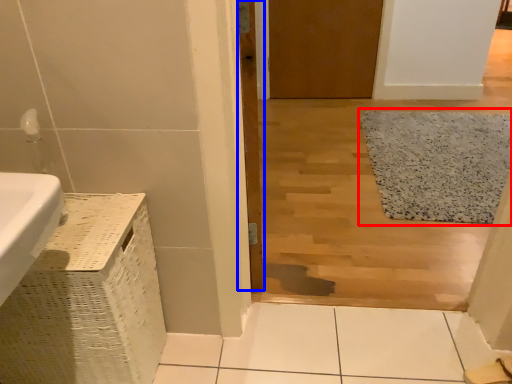
Question: Which point is further to the camera, bath mat (highlighted by a red box) or door (highlighted by a blue box)?

Choices:
 (A) bath mat
 (B) door

Answer: (A)